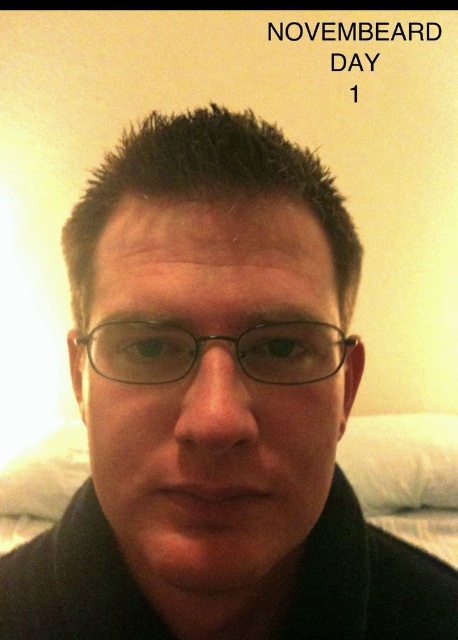
You are a photographer holding a camera. You want to take a portrait of the person wearing the matte black glasses at center. The camera requires a minimum distance of 10 inches to focus properly. Based on the scene, will the camera focus correctly?

The matte black glasses at center and camera are 9.33 inches apart. Since the required minimum distance is 10 inches, the camera is too close to focus properly.

You are a photographer adjusting the lighting for a portrait. You notice two pairs of glasses at the center of the image. The matte black glasses at center and the black plastic glasses at center. Which pair is closer to the camera?

The matte black glasses at center is closer to the camera than the black plastic glasses at center since the distance between them is 1.63 inches.

You are a photographer adjusting the focus of your camera. You need to ensure that the matte black glasses at center are in sharp focus. Given their position at point coordinates, which part of the image should you adjust the focus to?

Result: The matte black glasses at center are positioned at coordinates point [207,388], so you should adjust the focus to that point to ensure sharpness.